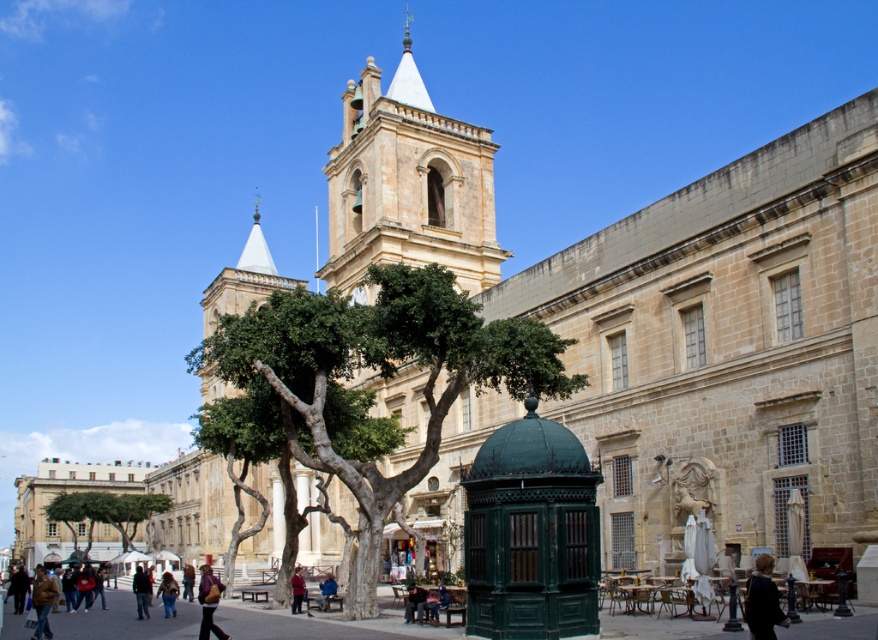
Is point (113, 515) positioned behind point (185, 586)?

That is True.

Measure the distance between green leafy tree at lower left and camera.

The distance of green leafy tree at lower left from camera is 150.73 meters.

Find the location of a particular element. green leafy tree at lower left is located at coordinates (106, 513).

Who is positioned more to the right, dark brown leather jacket at lower left or denim jacket at lower left?

denim jacket at lower left is more to the right.

Where is `dark brown leather jacket at lower left`? dark brown leather jacket at lower left is located at coordinates (141, 592).

What do you see at coordinates (141, 592) in the screenshot? I see `dark brown leather jacket at lower left` at bounding box center [141, 592].

At what (x,y) coordinates should I click in order to perform the action: click on dark brown leather jacket at lower left. Please return your answer as a coordinate pair (x, y). Looking at the image, I should click on (141, 592).

Between leather jacket at lower center and blue fabric jacket at lower center, which one is positioned higher?

blue fabric jacket at lower center

Is leather jacket at lower center shorter than blue fabric jacket at lower center?

In fact, leather jacket at lower center may be taller than blue fabric jacket at lower center.

I want to click on leather jacket at lower center, so click(209, 602).